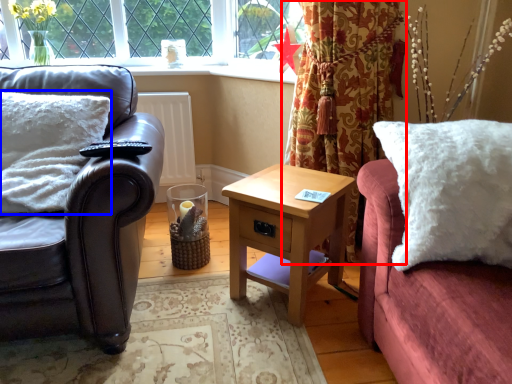
Question: Which object appears closest to the camera in this image, curtain (highlighted by a red box) or pillow (highlighted by a blue box)?

Choices:
 (A) curtain
 (B) pillow

Answer: (B)